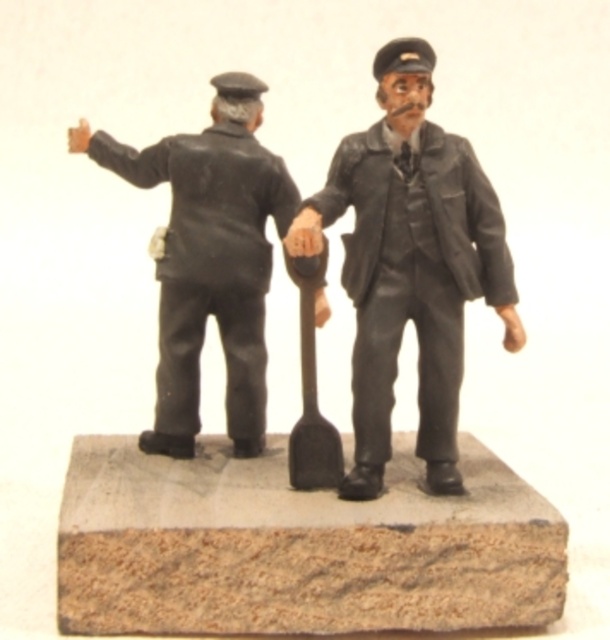
Question: Estimate the real-world distances between objects in this image. Which object is closer to the metallic gray shovel at center?

Choices:
 (A) matte black uniform at center
 (B) matte black figure at left

Answer: (A)

Question: Can you confirm if brown wood at center is wider than matte black uniform at center?

Choices:
 (A) yes
 (B) no

Answer: (A)

Question: Which point appears closest to the camera in this image?

Choices:
 (A) (253, 436)
 (B) (459, 346)
 (C) (314, 440)

Answer: (B)

Question: From the image, what is the correct spatial relationship of matte black figure at left in relation to metallic gray shovel at center?

Choices:
 (A) above
 (B) below

Answer: (A)

Question: Considering the real-world distances, which object is farthest from the metallic gray shovel at center?

Choices:
 (A) matte black figure at left
 (B) brown wood at center

Answer: (A)

Question: Can you confirm if matte black uniform at center is positioned to the right of metallic gray shovel at center?

Choices:
 (A) no
 (B) yes

Answer: (B)